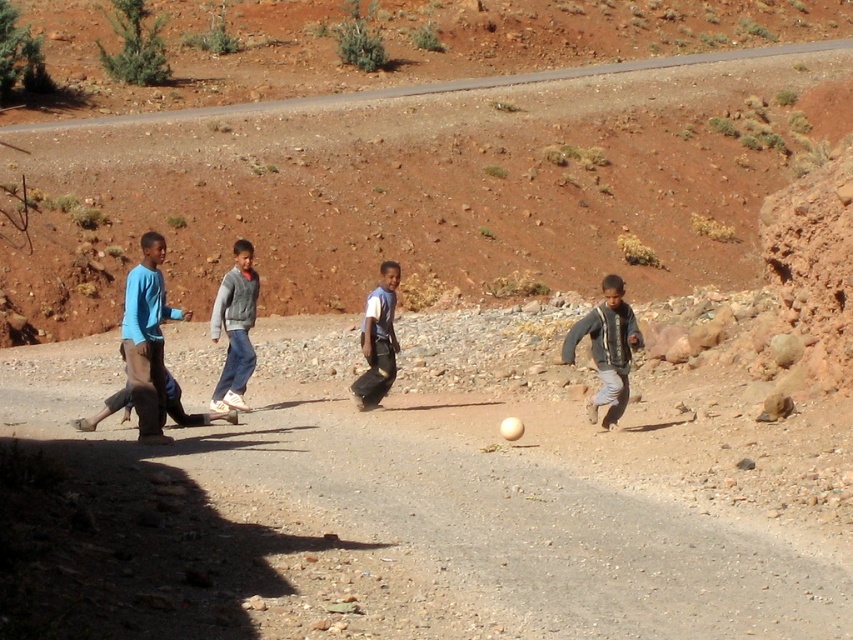
Who is shorter, gray textured jacket at right or white matte shirt at center?

With less height is gray textured jacket at right.

Based on the photo, is gray textured jacket at right closer to the viewer compared to white matte shirt at center?

That is True.

What do you see at coordinates (606, 348) in the screenshot?
I see `gray textured jacket at right` at bounding box center [606, 348].

Identify the location of gray textured jacket at right. (606, 348).

Does brown gravel road at center have a lesser width compared to blue matte shirt at center?

In fact, brown gravel road at center might be wider than blue matte shirt at center.

Does brown gravel road at center have a larger size compared to blue matte shirt at center?

Correct, brown gravel road at center is larger in size than blue matte shirt at center.

Where is `brown gravel road at center`? brown gravel road at center is located at coordinates (521, 486).

You are a GUI agent. You are given a task and a screenshot of the screen. Output one action in this format:
    pyautogui.click(x=<x>, y=<y>)
    Task: Click on the brown gravel road at center
    This screenshot has height=640, width=853.
    Given the screenshot: What is the action you would take?
    (521, 486)

Is blue matte shirt at center bigger than gray fleece jacket at center?

Yes, blue matte shirt at center is bigger than gray fleece jacket at center.

Who is positioned more to the right, blue matte shirt at center or gray fleece jacket at center?

Positioned to the right is gray fleece jacket at center.

Is point (135, 321) behind point (242, 384)?

No, (135, 321) is closer to viewer.

Locate an element on the screen. The height and width of the screenshot is (640, 853). blue matte shirt at center is located at coordinates (148, 337).